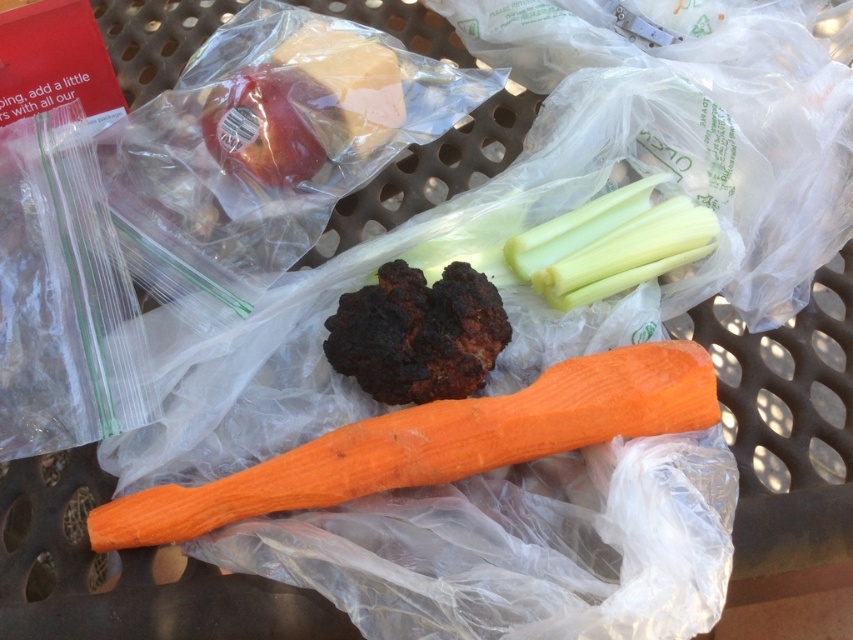
Is charcoal-baked chicken at center further to the viewer compared to red matte apple at upper left?

No, charcoal-baked chicken at center is in front of red matte apple at upper left.

Consider the image. Which is below, charcoal-baked chicken at center or red matte apple at upper left?

charcoal-baked chicken at center is below.

Between point (444, 380) and point (265, 145), which one is positioned behind?

The point (265, 145) is behind.

You are a GUI agent. You are given a task and a screenshot of the screen. Output one action in this format:
    pyautogui.click(x=<x>, y=<y>)
    Task: Click on the charcoal-baked chicken at center
    The width and height of the screenshot is (853, 640).
    Given the screenshot: What is the action you would take?
    pyautogui.click(x=418, y=333)

Who is lower down, orange smooth carrot at center or red matte apple at upper left?

orange smooth carrot at center is lower down.

Can you confirm if orange smooth carrot at center is bigger than red matte apple at upper left?

Yes.

Who is more distant from viewer, (653, 396) or (221, 134)?

Positioned behind is point (221, 134).

Where is `orange smooth carrot at center`? orange smooth carrot at center is located at coordinates (436, 444).

Is orange smooth carrot at center to the right of charcoal-baked chicken at center from the viewer's perspective?

Result: In fact, orange smooth carrot at center is to the left of charcoal-baked chicken at center.

Does orange smooth carrot at center appear on the left side of charcoal-baked chicken at center?

Yes, orange smooth carrot at center is to the left of charcoal-baked chicken at center.

Is point (421, 419) closer to viewer compared to point (473, 285)?

Yes.

This screenshot has height=640, width=853. Find the location of `orange smooth carrot at center`. orange smooth carrot at center is located at coordinates (436, 444).